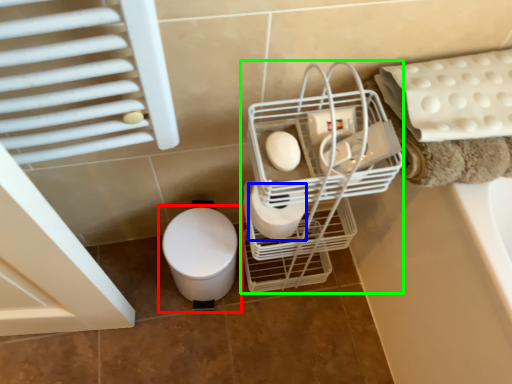
Question: Considering the real-world distances, which object is farthest from toilet (highlighted by a red box)? toilet paper (highlighted by a blue box) or trolley (highlighted by a green box)?

Choices:
 (A) toilet paper
 (B) trolley

Answer: (B)